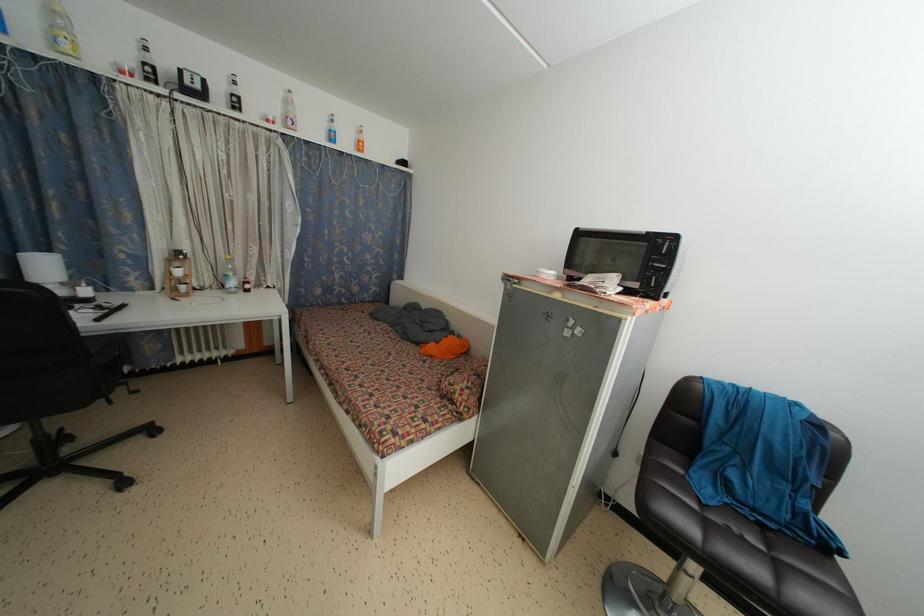
This screenshot has width=924, height=616. What do you see at coordinates (659, 265) in the screenshot? I see `the microwave door handle` at bounding box center [659, 265].